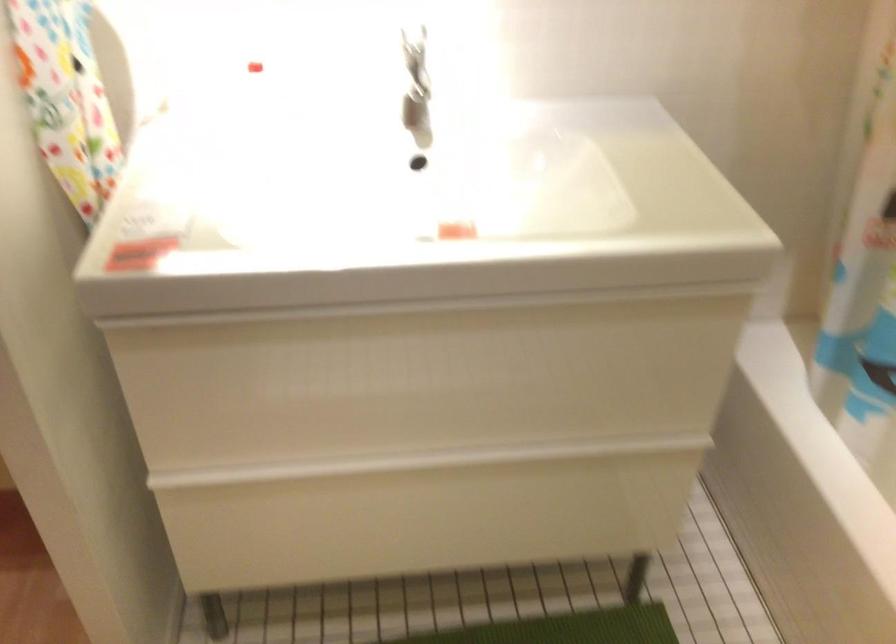
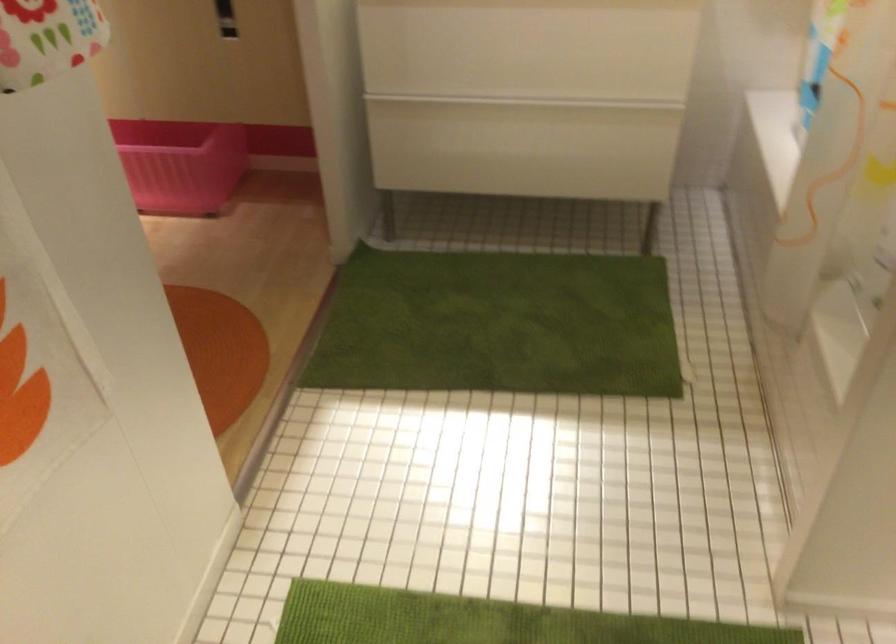
What movement of the cameraman would produce the second image?

The cameraman moved toward right, backward.